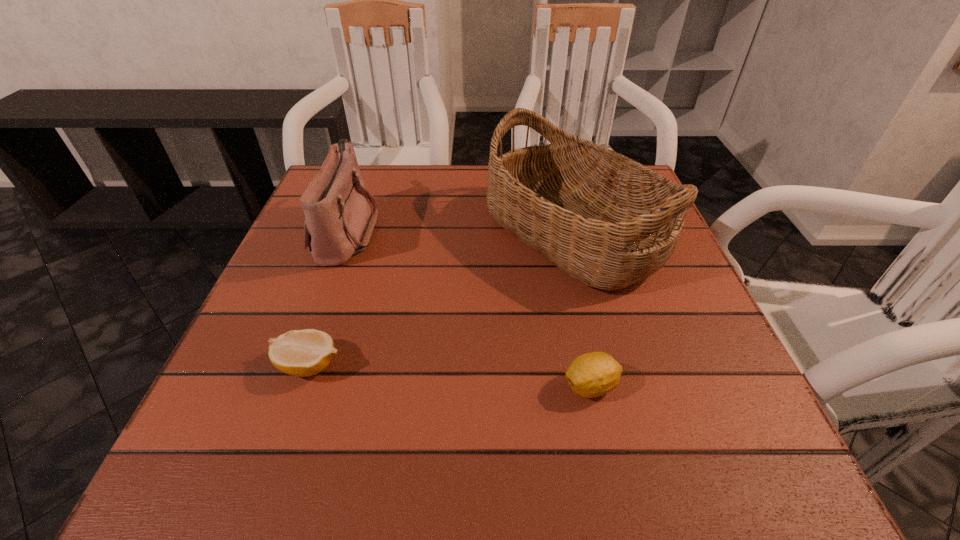
Locate an element on the screen. The width and height of the screenshot is (960, 540). vacant space that satisfies the following two spatial constraints: 1. on the front pocket of the basket; 2. on the left side of the third shortest object is located at coordinates (346, 233).

Where is `free spot that satisfies the following two spatial constraints: 1. on the front pocket of the shoulder bag; 2. on the back side of the basket`? free spot that satisfies the following two spatial constraints: 1. on the front pocket of the shoulder bag; 2. on the back side of the basket is located at coordinates (346, 233).